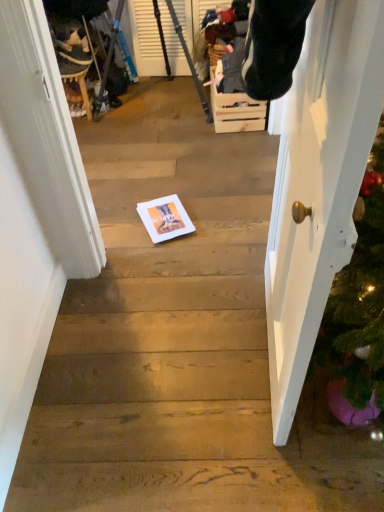
Question: Can you confirm if white paper at center is taller than velvet plush toy at upper left?

Choices:
 (A) no
 (B) yes

Answer: (A)

Question: Does white paper at center come in front of velvet plush toy at upper left?

Choices:
 (A) yes
 (B) no

Answer: (A)

Question: Is white paper at center at the right side of velvet plush toy at upper left?

Choices:
 (A) yes
 (B) no

Answer: (A)

Question: Would you say white paper at center is outside velvet plush toy at upper left?

Choices:
 (A) no
 (B) yes

Answer: (B)

Question: Can you confirm if white paper at center is shorter than velvet plush toy at upper left?

Choices:
 (A) no
 (B) yes

Answer: (B)

Question: Can you confirm if white paper at center is wider than velvet plush toy at upper left?

Choices:
 (A) no
 (B) yes

Answer: (B)

Question: From a real-world perspective, is metallic tripod at upper left over white glossy door at right?

Choices:
 (A) yes
 (B) no

Answer: (B)

Question: Can you confirm if metallic tripod at upper left is thinner than white glossy door at right?

Choices:
 (A) no
 (B) yes

Answer: (A)

Question: Is metallic tripod at upper left in contact with white glossy door at right?

Choices:
 (A) no
 (B) yes

Answer: (A)

Question: Is metallic tripod at upper left not near white glossy door at right?

Choices:
 (A) yes
 (B) no

Answer: (A)

Question: Can you confirm if metallic tripod at upper left is shorter than white glossy door at right?

Choices:
 (A) no
 (B) yes

Answer: (B)

Question: Is metallic tripod at upper left smaller than white glossy door at right?

Choices:
 (A) yes
 (B) no

Answer: (B)

Question: Is white paper at center not near wooden crate at center?

Choices:
 (A) no
 (B) yes

Answer: (A)